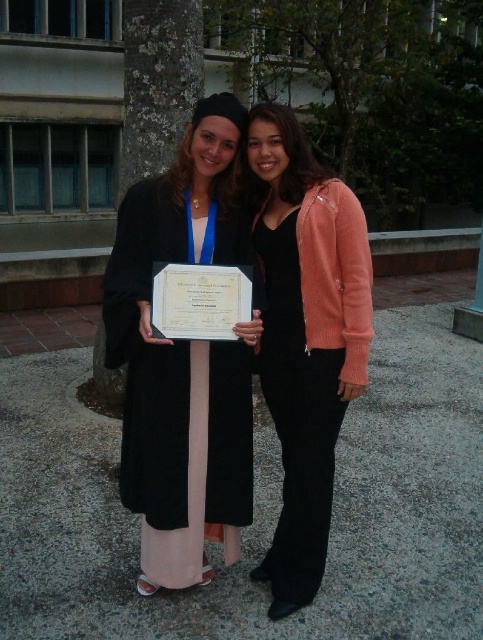
Question: Which point is closer to the camera taking this photo?

Choices:
 (A) (168, 476)
 (B) (358, 273)

Answer: (B)

Question: Is matte black graduation gown at center positioned before matte pink sweater at center?

Choices:
 (A) yes
 (B) no

Answer: (A)

Question: Which point is farther to the camera?

Choices:
 (A) matte pink sweater at center
 (B) matte black graduation gown at center

Answer: (A)

Question: Which point is closer to the camera taking this photo?

Choices:
 (A) (x=140, y=301)
 (B) (x=292, y=435)

Answer: (A)

Question: Can you confirm if matte black graduation gown at center is smaller than matte pink sweater at center?

Choices:
 (A) yes
 (B) no

Answer: (B)

Question: Does matte black graduation gown at center appear on the right side of matte pink sweater at center?

Choices:
 (A) yes
 (B) no

Answer: (B)